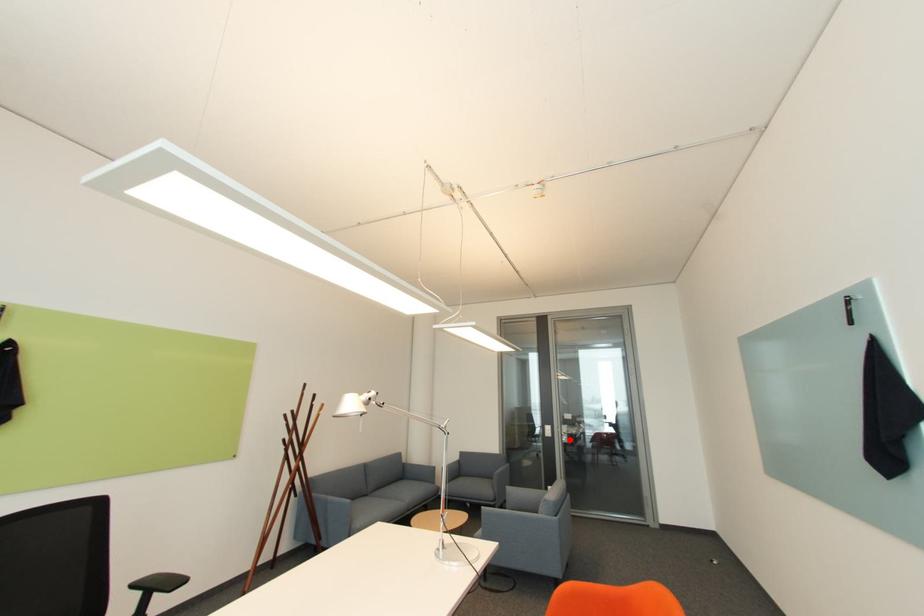
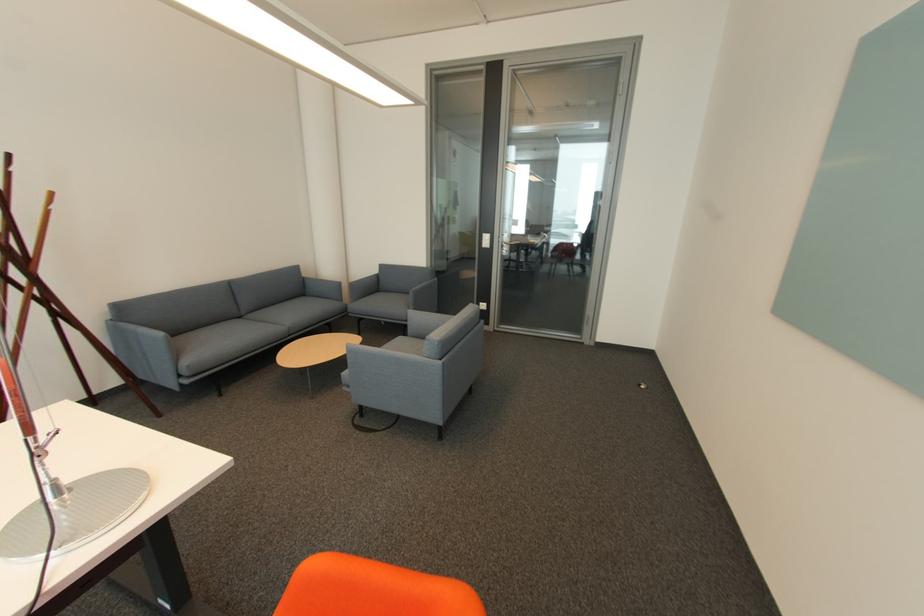
Find the pixel in the second image that matches the highlighted location in the first image.

(508, 252)